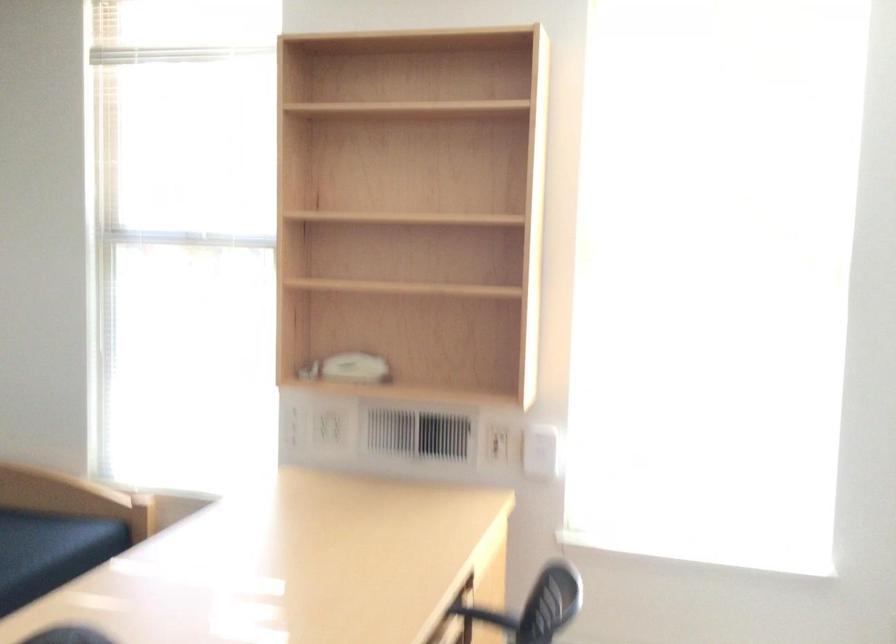
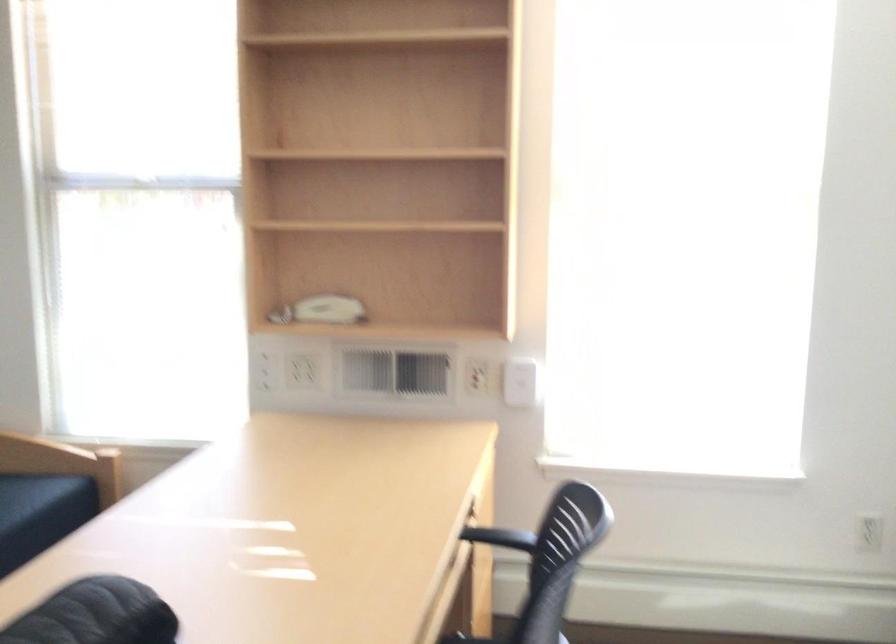
Question: Based on the continuous images, in which direction is the camera rotating? Reply with the corresponding letter.

Choices:
 (A) Left
 (B) Right
 (C) Up
 (D) Down

Answer: (B)